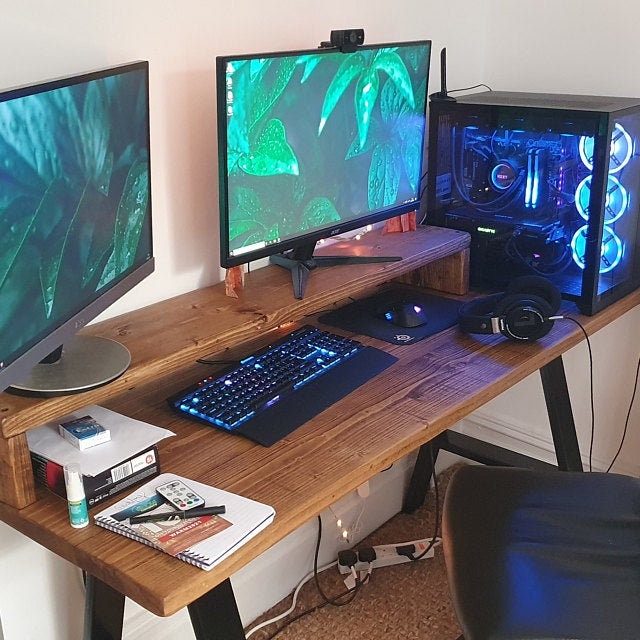
Image resolution: width=640 pixels, height=640 pixels. In order to click on mouse pad in this screenshot , I will do `click(408, 332)`.